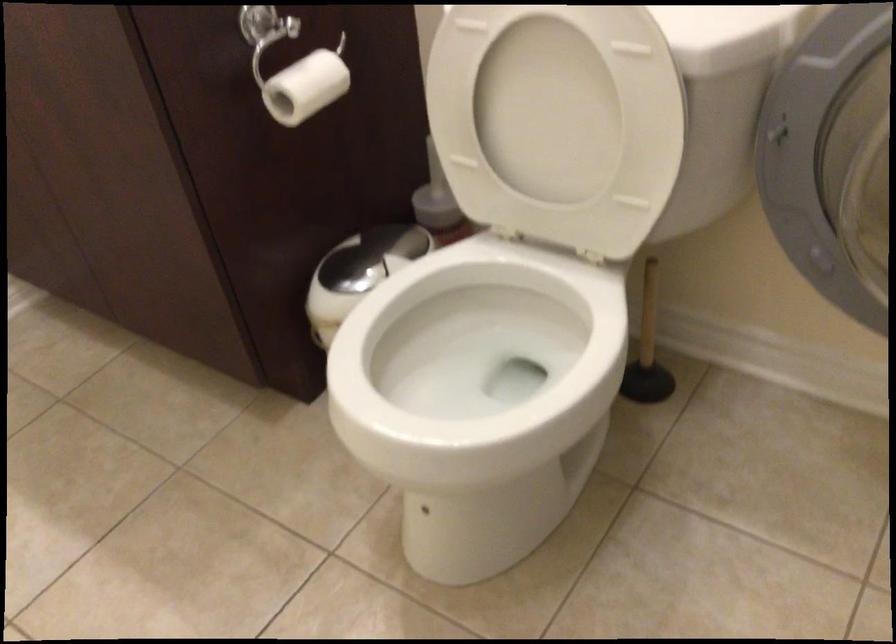
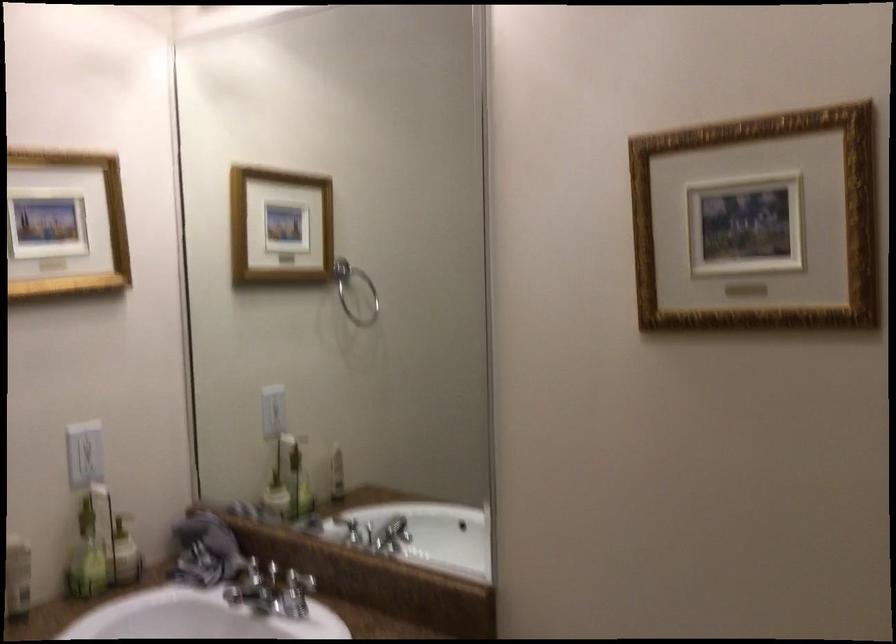
Question: How did the camera likely rotate?

Choices:
 (A) Left
 (B) Right
 (C) Up
 (D) Down

Answer: (C)